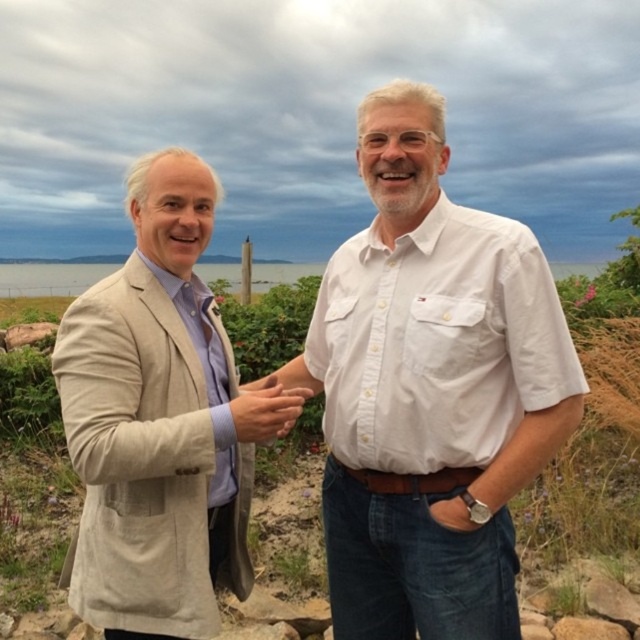
Does white cotton shirt at center have a larger size compared to matte beige hand at center?

Yes, white cotton shirt at center is bigger than matte beige hand at center.

Describe the element at coordinates (429, 390) in the screenshot. Image resolution: width=640 pixels, height=640 pixels. I see `white cotton shirt at center` at that location.

I want to click on white cotton shirt at center, so 429,390.

Is white cotton shirt at center taller than beige linen suit at left?

Yes.

Find the location of a particular element. The image size is (640, 640). white cotton shirt at center is located at coordinates coord(429,390).

Is white cotton shirt at center thinner than transparent water at center?

Correct, white cotton shirt at center's width is less than transparent water at center's.

Is the position of white cotton shirt at center less distant than that of transparent water at center?

Yes, it is in front of transparent water at center.

The image size is (640, 640). I want to click on white cotton shirt at center, so click(x=429, y=390).